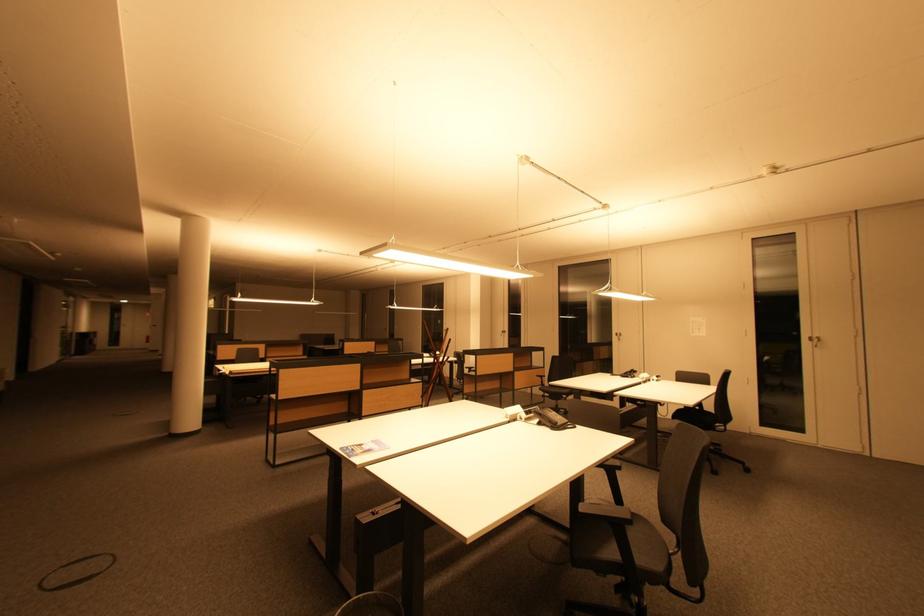
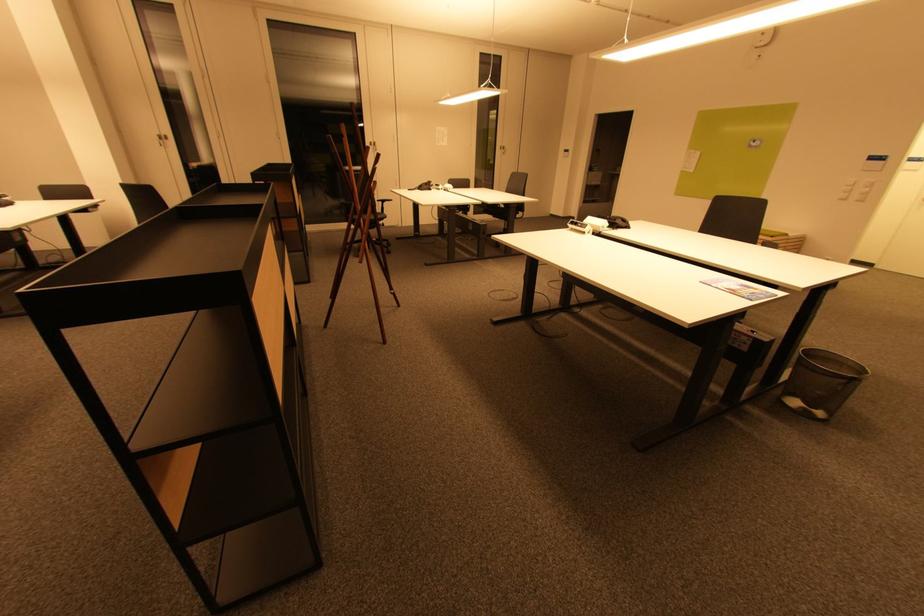
Find the pixel in the second image that matches (697,321) in the first image.

(442, 130)